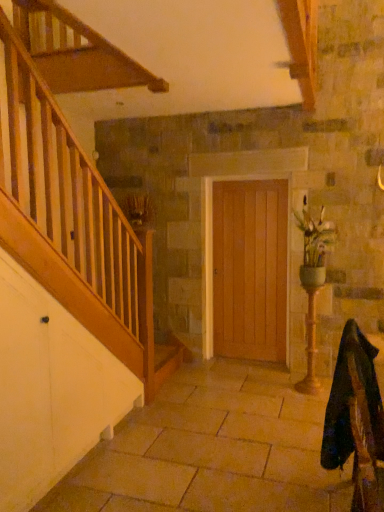
Question: From a real-world perspective, is brown textured plant at upper left beneath wooden door at center?

Choices:
 (A) no
 (B) yes

Answer: (A)

Question: Considering the relative sizes of brown textured plant at upper left and wooden door at center in the image provided, is brown textured plant at upper left smaller than wooden door at center?

Choices:
 (A) yes
 (B) no

Answer: (A)

Question: Does brown textured plant at upper left turn towards wooden door at center?

Choices:
 (A) no
 (B) yes

Answer: (A)

Question: Can you confirm if brown textured plant at upper left is thinner than wooden door at center?

Choices:
 (A) yes
 (B) no

Answer: (B)

Question: From a real-world perspective, is brown textured plant at upper left on wooden door at center?

Choices:
 (A) yes
 (B) no

Answer: (A)

Question: Which is correct: green ceramic vase at right is inside brown textured plant at upper left, or outside of it?

Choices:
 (A) outside
 (B) inside

Answer: (A)

Question: From the image's perspective, is green ceramic vase at right above or below brown textured plant at upper left?

Choices:
 (A) below
 (B) above

Answer: (A)

Question: From a real-world perspective, is green ceramic vase at right above or below brown textured plant at upper left?

Choices:
 (A) below
 (B) above

Answer: (A)

Question: From their relative heights in the image, would you say green ceramic vase at right is taller or shorter than brown textured plant at upper left?

Choices:
 (A) tall
 (B) short

Answer: (A)

Question: Is brown textured plant at upper left situated inside velvet dark green rocking chair at lower right or outside?

Choices:
 (A) outside
 (B) inside

Answer: (A)

Question: From a real-world perspective, relative to velvet dark green rocking chair at lower right, is brown textured plant at upper left vertically above or below?

Choices:
 (A) below
 (B) above

Answer: (B)

Question: Relative to velvet dark green rocking chair at lower right, is brown textured plant at upper left in front or behind?

Choices:
 (A) front
 (B) behind

Answer: (B)

Question: Visually, is brown textured plant at upper left positioned to the left or to the right of velvet dark green rocking chair at lower right?

Choices:
 (A) left
 (B) right

Answer: (A)

Question: Considering the positions of green ceramic vase at right and velvet dark green rocking chair at lower right in the image, is green ceramic vase at right taller or shorter than velvet dark green rocking chair at lower right?

Choices:
 (A) tall
 (B) short

Answer: (A)

Question: Considering their positions, is green ceramic vase at right located in front of or behind velvet dark green rocking chair at lower right?

Choices:
 (A) behind
 (B) front

Answer: (A)